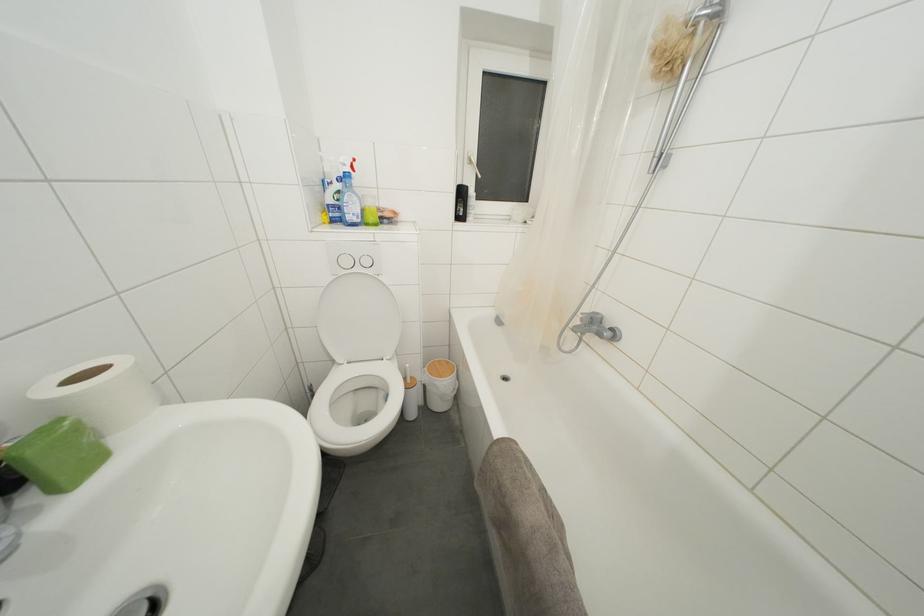
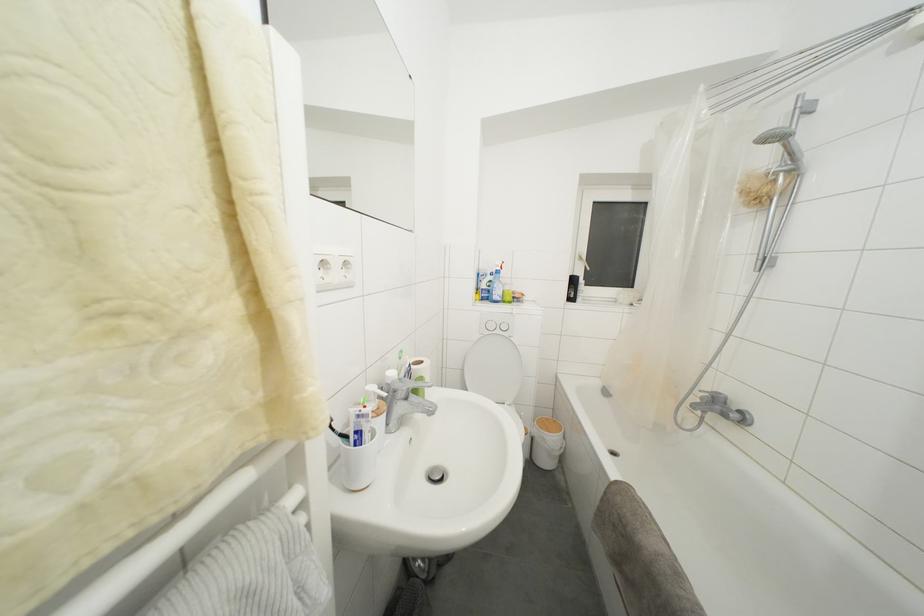
In the second image, find the point that corresponds to (x=500, y=440) in the first image.

(617, 484)